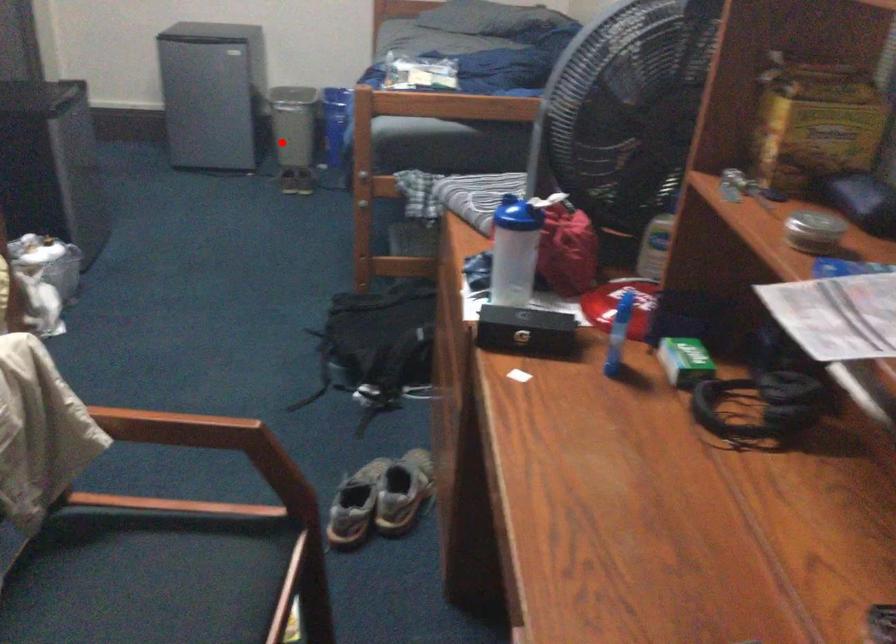
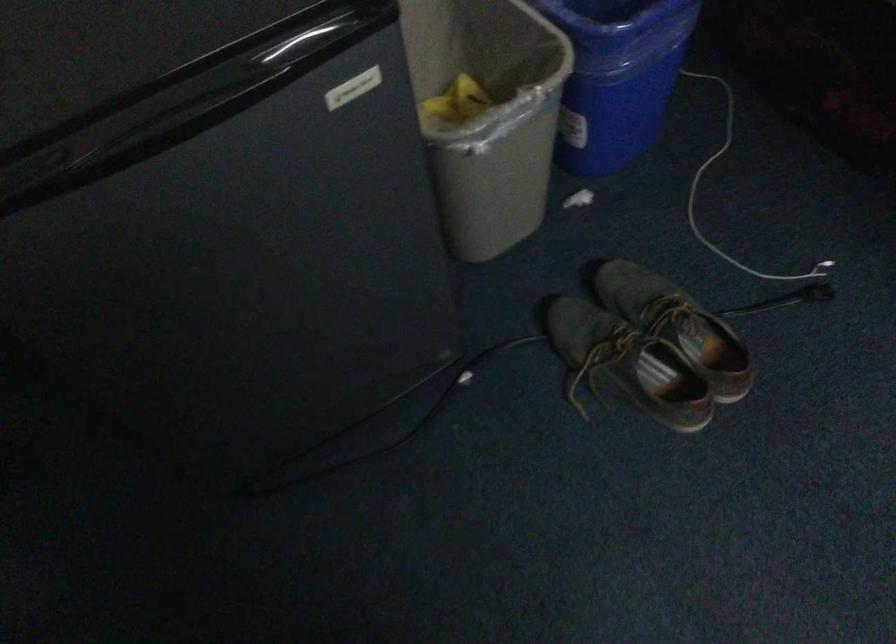
Find the pixel in the second image that matches the highlighted location in the first image.

(662, 323)